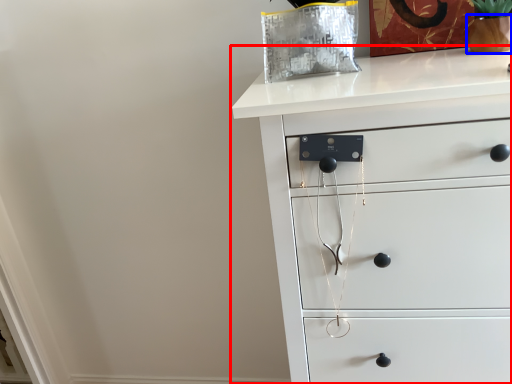
Question: Which object appears farthest to the camera in this image, chest of drawers (highlighted by a red box) or glass vase (highlighted by a blue box)?

Choices:
 (A) chest of drawers
 (B) glass vase

Answer: (B)